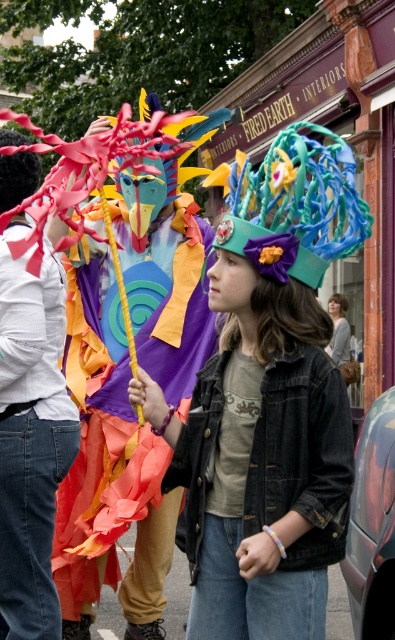
Question: Is matte green fabric hat at center to the right of matte black shirt at left from the viewer's perspective?

Choices:
 (A) yes
 (B) no

Answer: (A)

Question: Based on their relative distances, which object is nearer to the matte blue fabric headdress at center?

Choices:
 (A) matte green fabric hat at center
 (B) matte black shirt at left

Answer: (A)

Question: Can you confirm if matte black shirt at left is positioned to the right of matte blue fabric headdress at center?

Choices:
 (A) no
 (B) yes

Answer: (A)

Question: Can you confirm if matte black shirt at left is bigger than matte blue fabric headdress at center?

Choices:
 (A) yes
 (B) no

Answer: (A)

Question: Considering the real-world distances, which object is farthest from the matte blue fabric headdress at center?

Choices:
 (A) light brown hair at center
 (B) matte black shirt at left

Answer: (A)

Question: Which point is farther to the camera?

Choices:
 (A) matte blue fabric headdress at center
 (B) matte green fabric hat at center
 (C) light brown hair at center

Answer: (C)